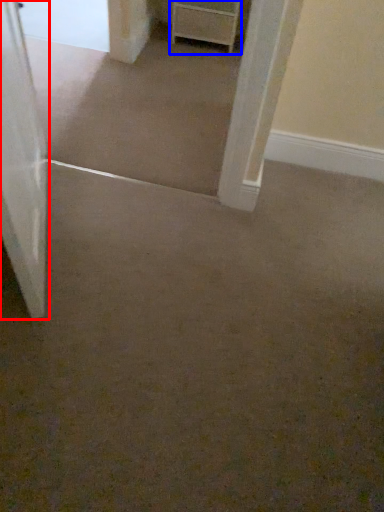
Question: Which of the following is the farthest to the observer, door (highlighted by a red box) or chest of drawers (highlighted by a blue box)?

Choices:
 (A) door
 (B) chest of drawers

Answer: (B)